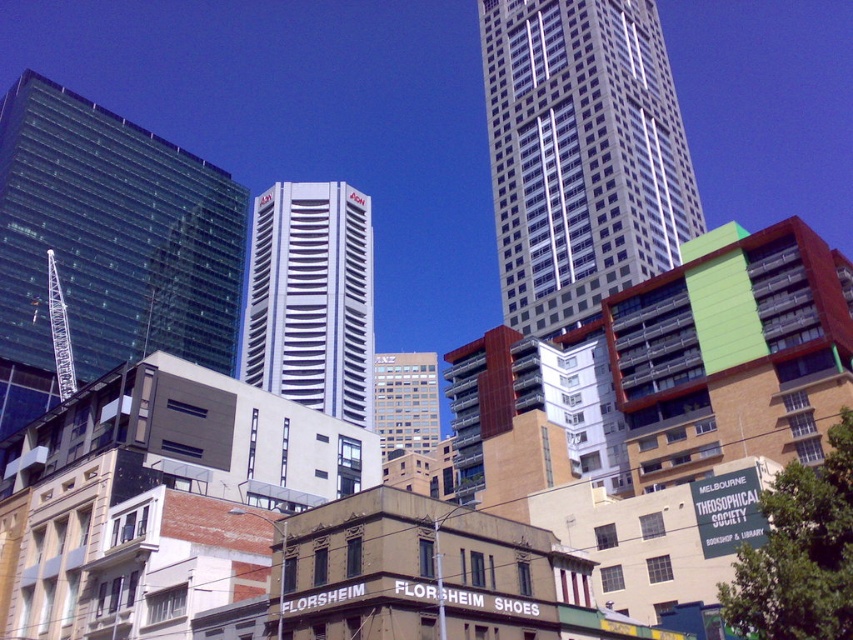
Is point (573, 227) closer to camera compared to point (335, 268)?

That is True.

In the scene shown: Who is shorter, white glass skyscraper at center or white glossy building at center?

Standing shorter between the two is white glossy building at center.

Is point (564, 170) positioned before point (259, 330)?

Yes, point (564, 170) is closer to viewer.

Where is `white glass skyscraper at center`? white glass skyscraper at center is located at coordinates (581, 154).